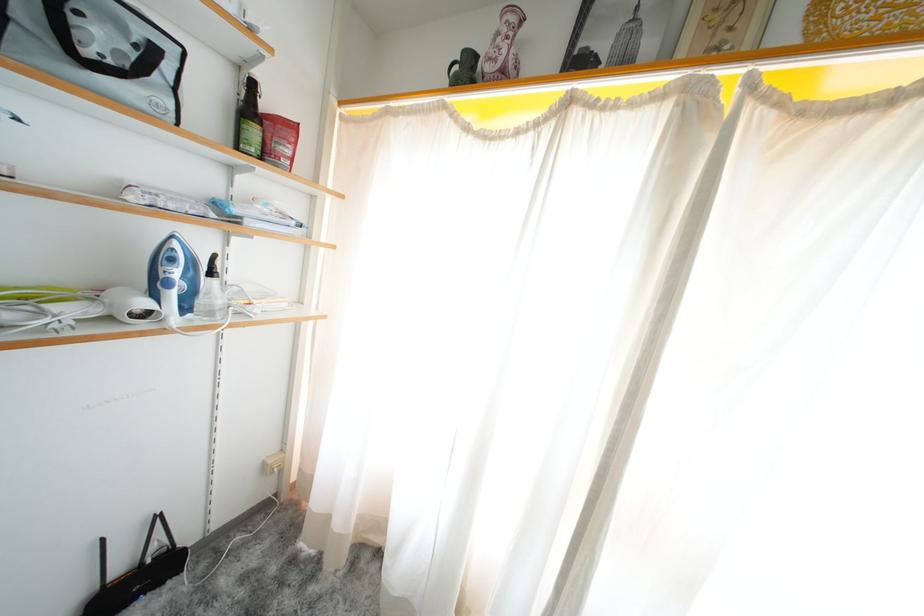
Image resolution: width=924 pixels, height=616 pixels. Identify the location of dark jug handle. (137, 573).